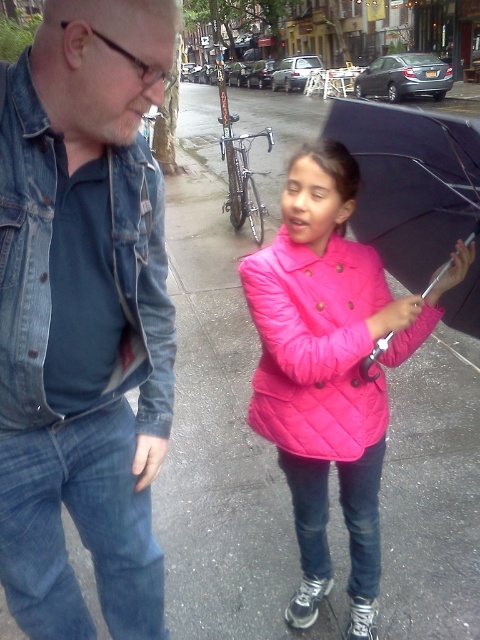
Question: Which object is closer to the camera taking this photo?

Choices:
 (A) quilted pink coat at center
 (B) denim jacket at left
 (C) pink quilted jacket at center

Answer: (B)

Question: Does denim jacket at left have a greater width compared to quilted pink coat at center?

Choices:
 (A) yes
 (B) no

Answer: (B)

Question: Estimate the real-world distances between objects in this image. Which object is farther from the pink quilted jacket at center?

Choices:
 (A) black matte umbrella at center
 (B) quilted pink coat at center
 (C) denim jacket at left

Answer: (C)

Question: Based on their relative distances, which object is nearer to the pink quilted jacket at center?

Choices:
 (A) quilted pink coat at center
 (B) denim jacket at left

Answer: (A)

Question: Can you confirm if pink quilted jacket at center is wider than quilted pink coat at center?

Choices:
 (A) yes
 (B) no

Answer: (A)

Question: Can you confirm if quilted pink coat at center is wider than black matte umbrella at center?

Choices:
 (A) no
 (B) yes

Answer: (B)